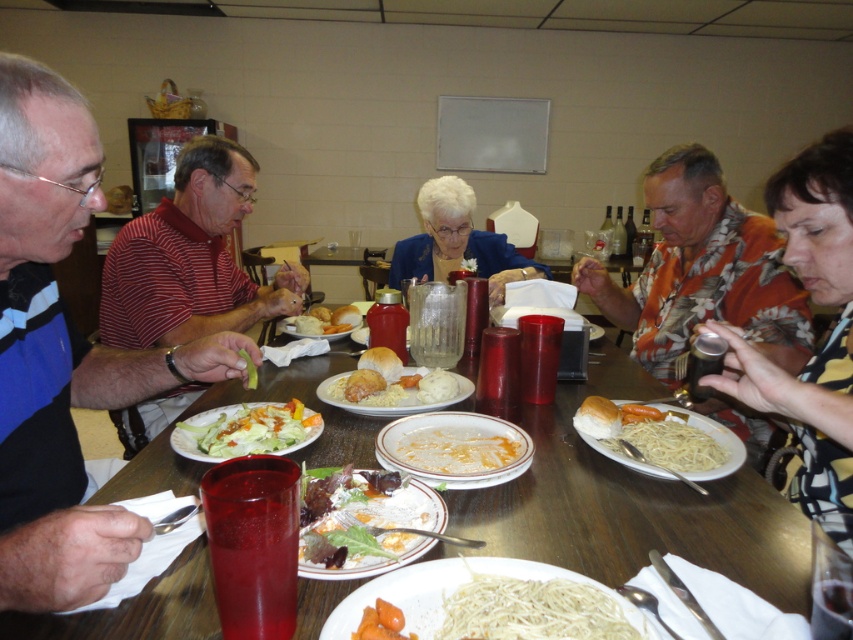
Question: Based on their relative distances, which object is nearer to the white matte noodles at center?

Choices:
 (A) wooden table at center
 (B) blue fabric jacket at center
 (C) matte white bread at center
 (D) white bread at center

Answer: (A)

Question: Is red striped shirt at center smaller than yellow striped shirt at right?

Choices:
 (A) no
 (B) yes

Answer: (A)

Question: Is white matte plate at center positioned behind white matte spaghetti at lower right?

Choices:
 (A) yes
 (B) no

Answer: (B)

Question: Which object is the closest to the matte white bread at center?

Choices:
 (A) yellow striped shirt at right
 (B) white matte pasta at center
 (C) white bread at center

Answer: (C)

Question: Estimate the real-world distances between objects in this image. Which object is farther from the matte white bread at center?

Choices:
 (A) salad with dressing at center
 (B) white bread at center
 (C) wooden table at center
 (D) blue shirt at left

Answer: (A)

Question: Where is blue fabric jacket at center located in relation to white matte spaghetti at lower right in the image?

Choices:
 (A) below
 (B) above

Answer: (B)